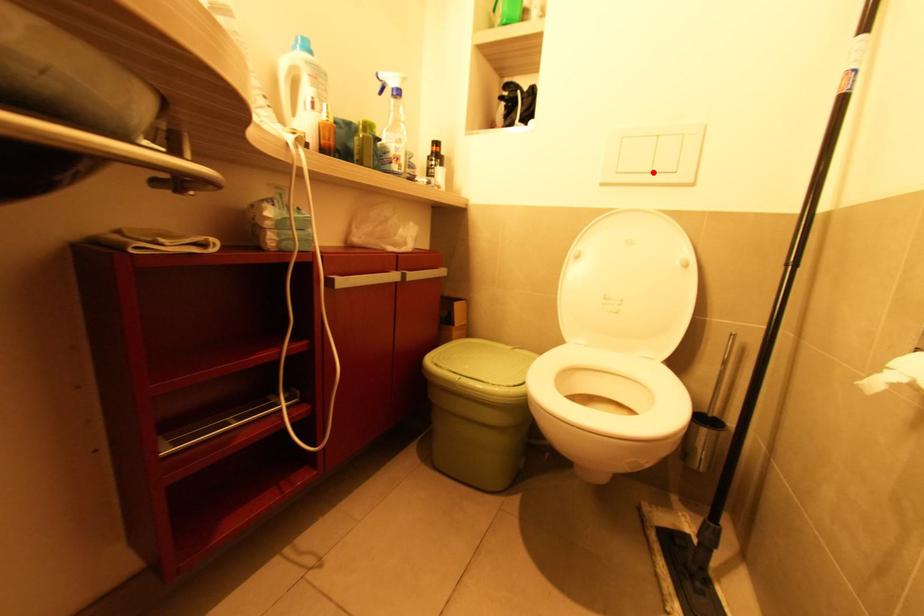
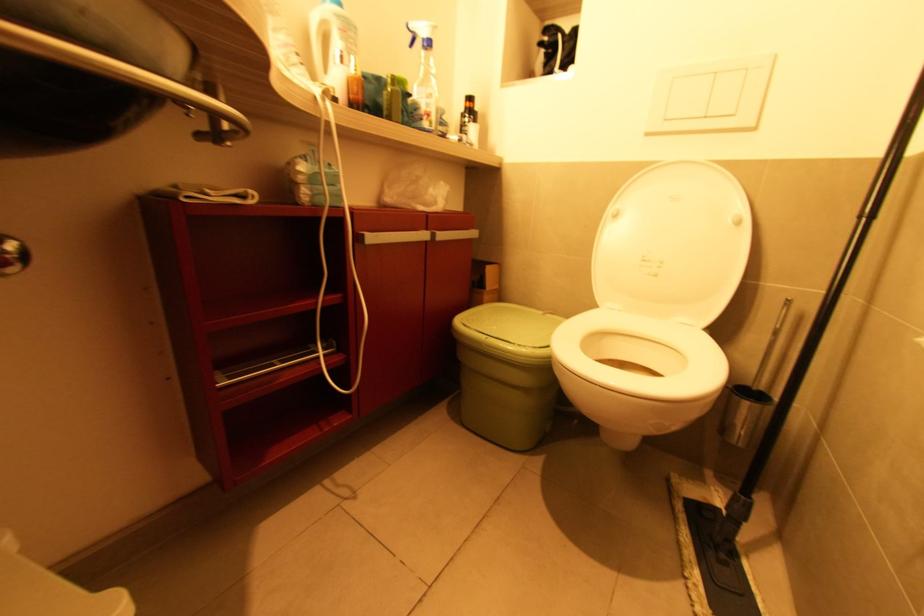
Find the pixel in the second image that matches the highlighted location in the first image.

(709, 118)